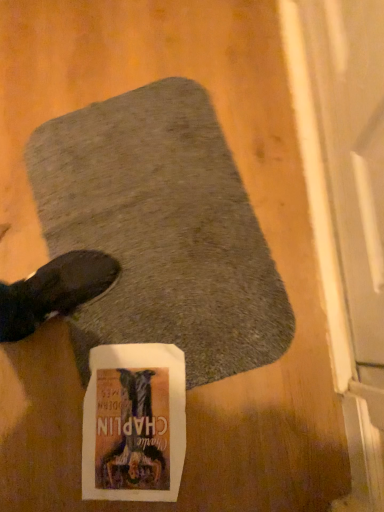
Image resolution: width=384 pixels, height=512 pixels. I want to click on vacant space underneath gray soft rug at center (from a real-world perspective), so click(155, 241).